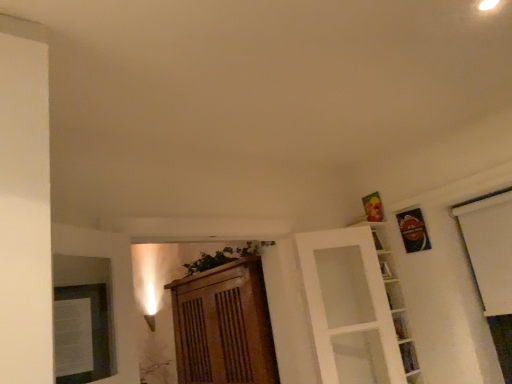
Question: In the image, is white glass door at upper right positioned in front of or behind clear glass shelf at lower right, the first shelf when ordered from bottom to top?

Choices:
 (A) behind
 (B) front

Answer: (B)

Question: From their relative heights in the image, would you say white glass door at upper right is taller or shorter than clear glass shelf at lower right, the first shelf when ordered from bottom to top?

Choices:
 (A) tall
 (B) short

Answer: (A)

Question: Which object is positioned closest to the clear glass shelf at lower right, which is counted as the second shelf, starting from the top?

Choices:
 (A) white glass shelves at upper right, which is the second shelf in bottom-to-top order
 (B) white glass door at upper right
 (C) wooden cabinet at center

Answer: (A)

Question: Which object is the farthest from the white glass shelves at upper right, placed as the 1th shelf when sorted from top to bottom?

Choices:
 (A) wooden cabinet at center
 (B) white glass door at upper right
 (C) clear glass shelf at lower right, the first shelf when ordered from bottom to top

Answer: (A)